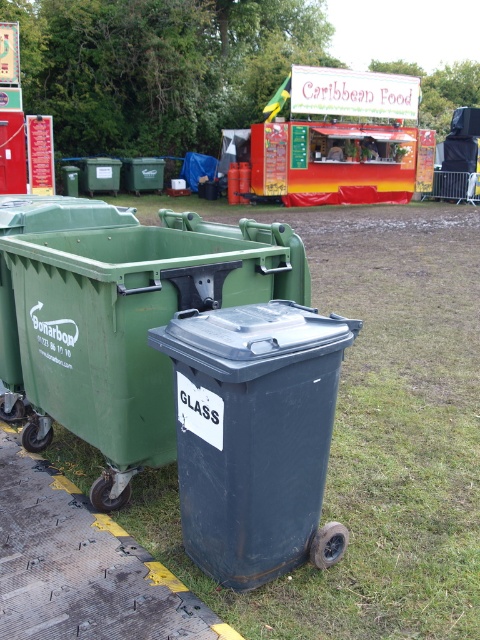
Looking at this image, can you confirm if caribbean food cart at center is positioned above matte gray bin at center?

Correct, caribbean food cart at center is located above matte gray bin at center.

Which of these two, caribbean food cart at center or matte gray bin at center, stands shorter?

matte gray bin at center

Between point (118, 35) and point (326, 440), which one is positioned behind?

The point (118, 35) is more distant.

Locate an element on the screen. The image size is (480, 640). caribbean food cart at center is located at coordinates (159, 67).

Can you confirm if matte black bin at center is wider than matte gray bin at center?

Yes.

Which is more to the left, matte black bin at center or matte gray bin at center?

From the viewer's perspective, matte black bin at center appears more on the left side.

Find the location of a particular element. This screenshot has width=480, height=640. matte black bin at center is located at coordinates coord(119,317).

Is green grass at lower right below matte black bin at center?

Incorrect, green grass at lower right is not positioned below matte black bin at center.

Image resolution: width=480 pixels, height=640 pixels. I want to click on green grass at lower right, so click(x=370, y=433).

Which is behind, point (288, 618) or point (16, 269)?

The point (16, 269) is more distant.

The height and width of the screenshot is (640, 480). I want to click on green grass at lower right, so pos(370,433).